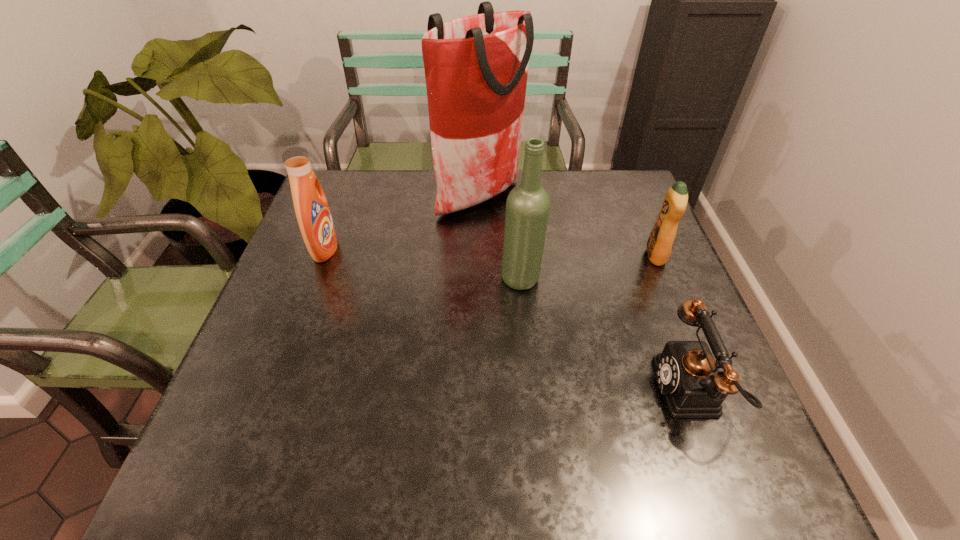
At what (x,y) coordinates should I click in order to perform the action: click on vacant space that satisfies the following two spatial constraints: 1. on the front-facing side of the taller detergent; 2. on the right side of the second tallest object. Please return your answer as a coordinate pair (x, y). This screenshot has width=960, height=540. Looking at the image, I should click on (314, 279).

Image resolution: width=960 pixels, height=540 pixels. What are the coordinates of `free location that satisfies the following two spatial constraints: 1. on the front-facing side of the taller detergent; 2. on the back side of the wine bottle` in the screenshot? It's located at (314, 279).